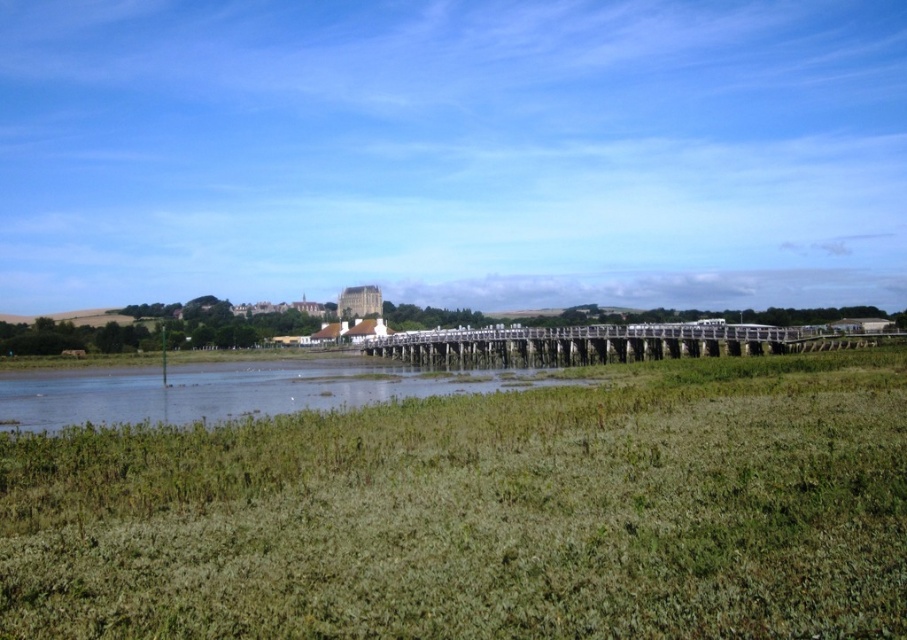
Can you confirm if green grassy wetland at lower center is shorter than wooden bridge at center?

Correct, green grassy wetland at lower center is not as tall as wooden bridge at center.

Who is lower down, green grassy wetland at lower center or wooden bridge at center?

green grassy wetland at lower center is below.

Between point (314, 378) and point (700, 339), which one is positioned behind?

The point (314, 378) is behind.

This screenshot has height=640, width=907. I want to click on green grassy wetland at lower center, so click(x=232, y=388).

Can you confirm if green grassy at center is smaller than wooden bridge at center?

Yes.

Which of these two, green grassy at center or wooden bridge at center, stands taller?

With more height is wooden bridge at center.

Is point (474, 499) closer to viewer compared to point (600, 337)?

Yes, point (474, 499) is closer to viewer.

The image size is (907, 640). Find the location of `green grassy at center`. green grassy at center is located at coordinates (483, 513).

In the scene shown: Between green grassy at center and green grassy wetland at lower center, which one has more height?

green grassy wetland at lower center

Is green grassy at center to the left of green grassy wetland at lower center from the viewer's perspective?

No, green grassy at center is not to the left of green grassy wetland at lower center.

Is point (577, 556) in front of point (42, 410)?

Yes, point (577, 556) is in front of point (42, 410).

This screenshot has height=640, width=907. I want to click on green grassy at center, so click(483, 513).